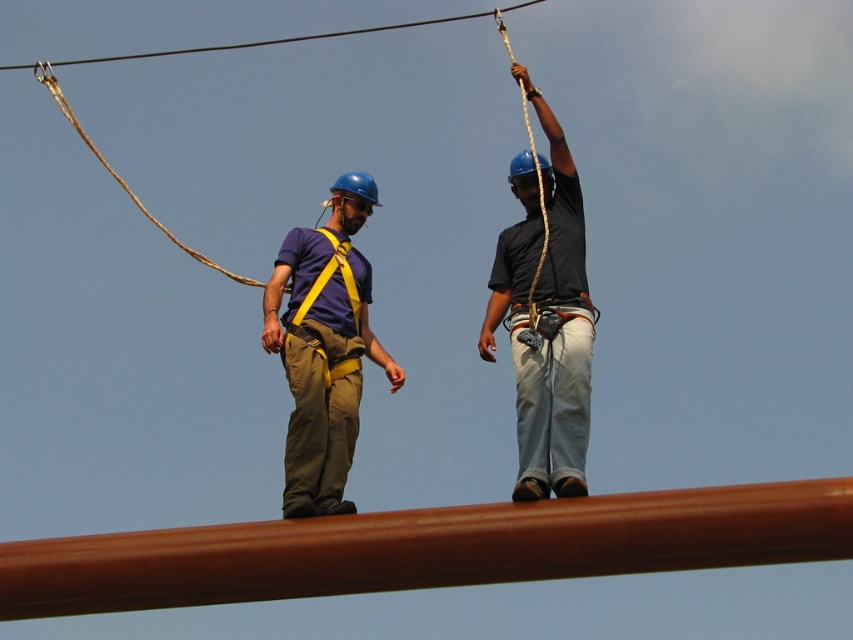
You are a safety inspector assessing the scene. You notice the brown polished pole at center and the yellow fabric safety vest at center. Which object is shorter in height?

The brown polished pole at center is not as tall as the yellow fabric safety vest at center, so the brown polished pole at center is shorter in height.

You are a safety inspector checking the work site depicted in the image. You notice a specific point at coordinates (428, 548). Where is this point located in relation to the brown polished pole at center?

The point (428, 548) is located on the brown polished pole at center.